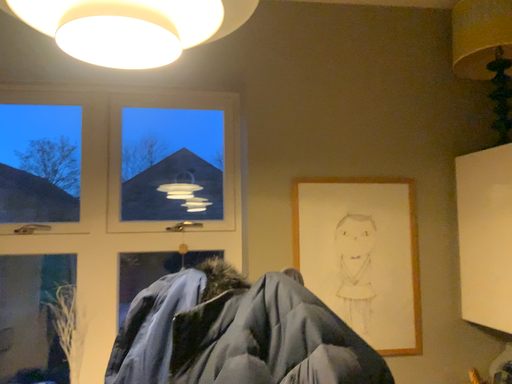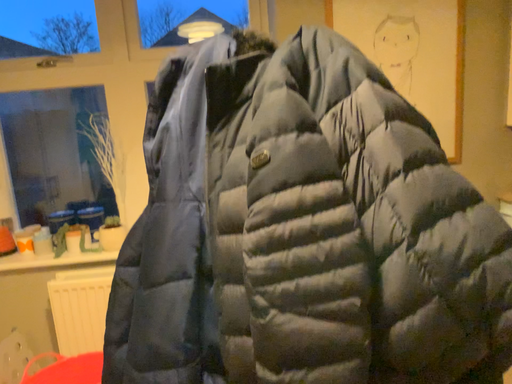
Question: Which way did the camera rotate in the video?

Choices:
 (A) rotated upward
 (B) rotated downward

Answer: (B)